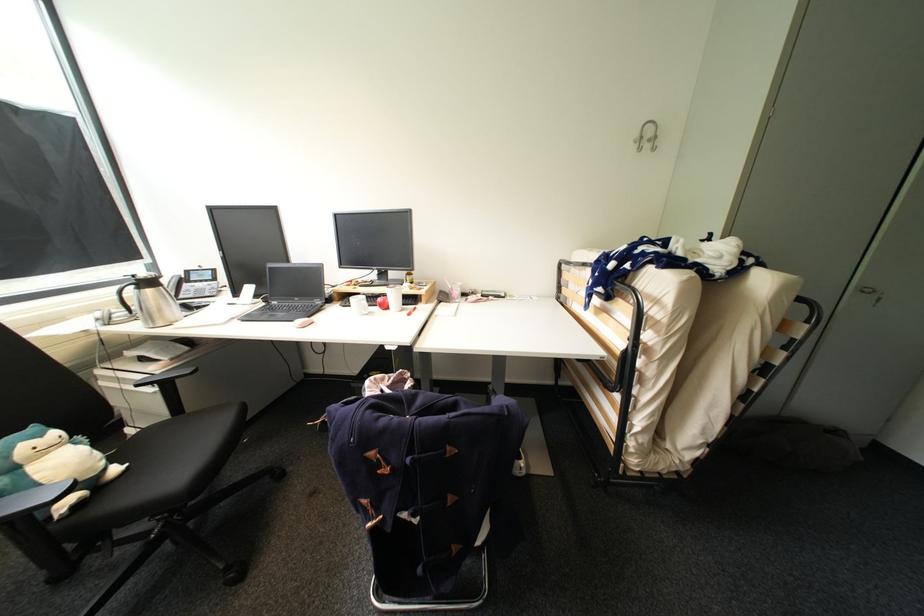
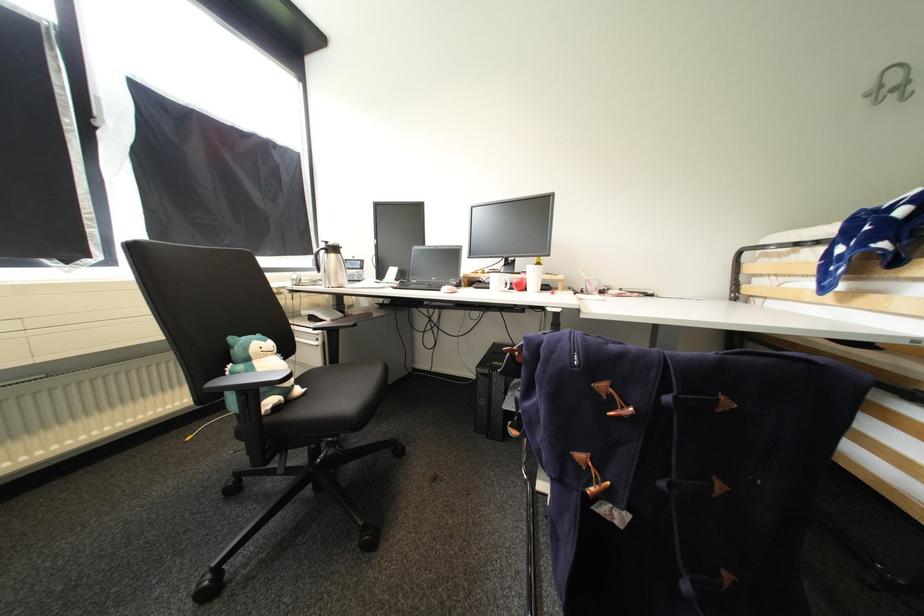
Question: The images are taken continuously from a first-person perspective. In which direction are you moving?

Choices:
 (A) Left
 (B) Right
 (C) Forward
 (D) Backward

Answer: (A)